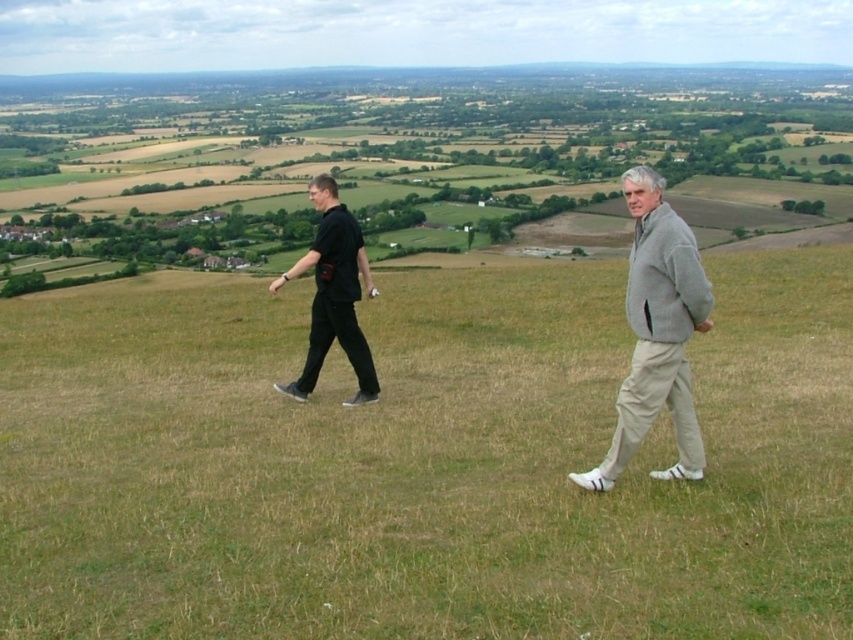
Is green grassy field at center in front of gray fleece jacket at center?

Yes.

Which is more to the left, green grassy field at center or gray fleece jacket at center?

From the viewer's perspective, green grassy field at center appears more on the left side.

Locate an element on the screen. The height and width of the screenshot is (640, 853). green grassy field at center is located at coordinates pyautogui.click(x=424, y=464).

Is green grassy field at center below black matte pants at left?

Yes, green grassy field at center is below black matte pants at left.

Can you confirm if green grassy field at center is wider than black matte pants at left?

Indeed, green grassy field at center has a greater width compared to black matte pants at left.

Is point (350, 458) farther from viewer compared to point (328, 198)?

No, it is in front of (328, 198).

Image resolution: width=853 pixels, height=640 pixels. Find the location of `green grassy field at center`. green grassy field at center is located at coordinates (424, 464).

Does green grassy field at center appear under black cotton shirt at left?

Yes.

Is green grassy field at center smaller than black cotton shirt at left?

Actually, green grassy field at center might be larger than black cotton shirt at left.

Find the location of a particular element. green grassy field at center is located at coordinates (424, 464).